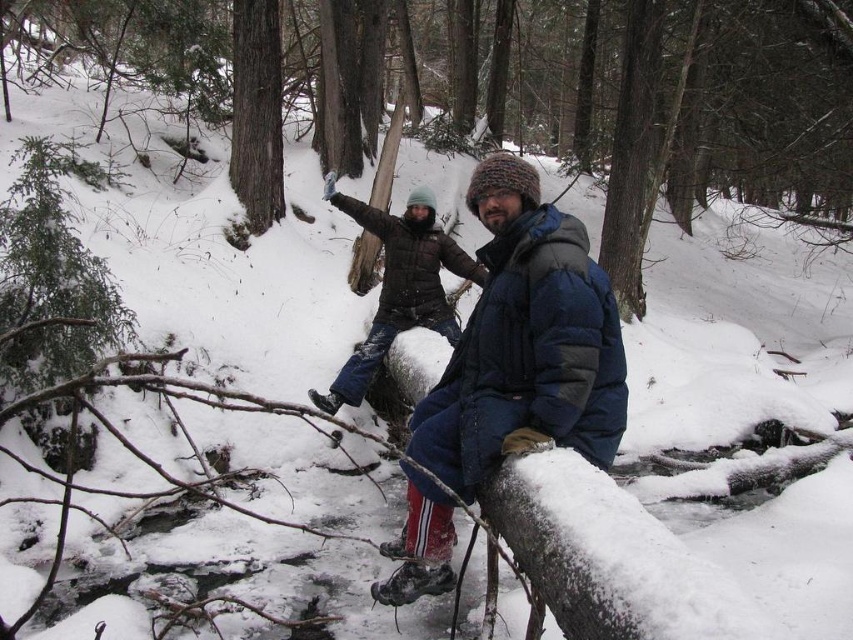
Question: Which point is farther to the camera?

Choices:
 (A) smooth brown tree trunk at upper center
 (B) matte black jacket at center

Answer: (A)

Question: Can you confirm if blue down jacket at center is positioned to the right of smooth brown tree trunk at upper center?

Choices:
 (A) no
 (B) yes

Answer: (B)

Question: Which point is farther to the camera?

Choices:
 (A) (486, 161)
 (B) (260, 93)
 (C) (434, 252)

Answer: (B)

Question: Can you confirm if blue down jacket at center is wider than matte black jacket at center?

Choices:
 (A) yes
 (B) no

Answer: (B)

Question: Is blue down jacket at center smaller than matte black jacket at center?

Choices:
 (A) yes
 (B) no

Answer: (B)

Question: Among these objects, which one is farthest from the camera?

Choices:
 (A) smooth brown tree trunk at upper center
 (B) blue down jacket at center

Answer: (A)